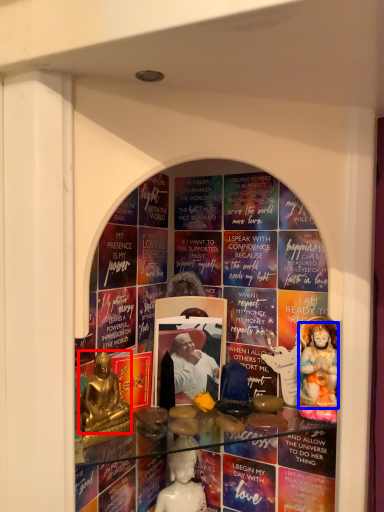
Question: Which of the following is the closest to the observer, person (highlighted by a red box) or person (highlighted by a blue box)?

Choices:
 (A) person
 (B) person

Answer: (A)